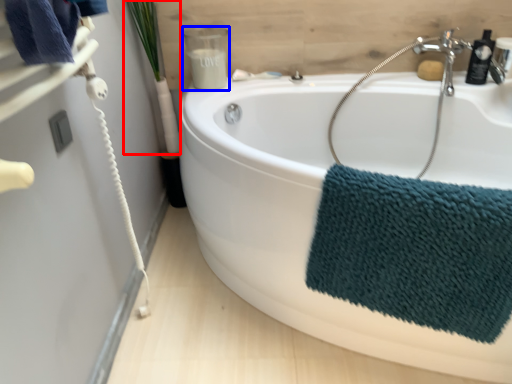
Question: Which object is further to the camera taking this photo, plant (highlighted by a red box) or toiletry (highlighted by a blue box)?

Choices:
 (A) plant
 (B) toiletry

Answer: (B)